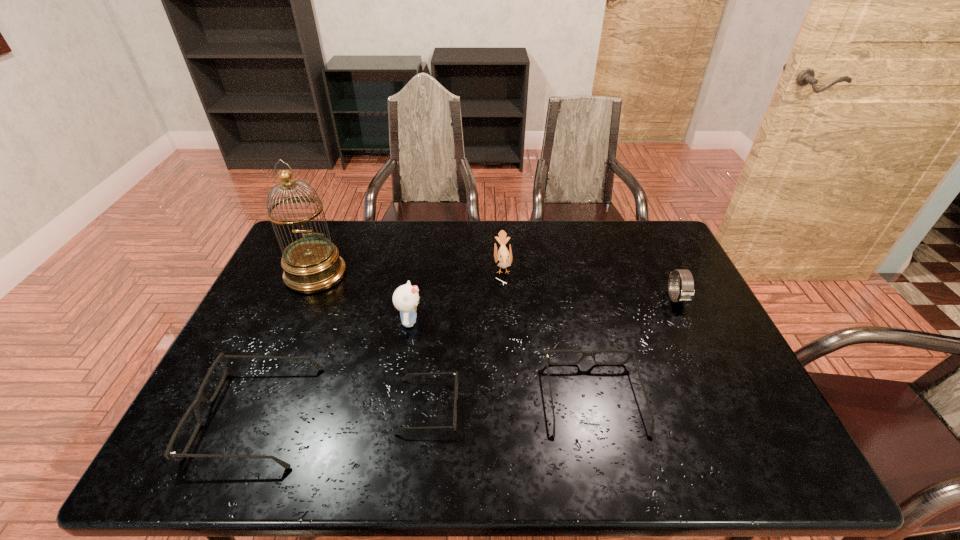
The image size is (960, 540). Find the location of `bird at the far edge`. bird at the far edge is located at coordinates (503, 258).

The height and width of the screenshot is (540, 960). Identify the location of birdcage at the far edge. (312, 264).

At what (x,y) coordinates should I click in order to perform the action: click on spectacles located at the left edge. Please return your answer as a coordinate pair (x, y). Looking at the image, I should click on (169, 454).

The image size is (960, 540). In order to click on birdcage positioned at the left edge in this screenshot , I will do `click(312, 264)`.

I want to click on object that is at the right edge, so click(686, 294).

You are a GUI agent. You are given a task and a screenshot of the screen. Output one action in this format:
    pyautogui.click(x=<x>, y=<y>)
    Task: Click on the object at the far left corner
    
    Given the screenshot: What is the action you would take?
    pyautogui.click(x=312, y=264)

Locate an element on the screen. This screenshot has width=960, height=540. object at the near left corner is located at coordinates 169,454.

Find the location of a particular element. Image resolution: width=960 pixels, height=540 pixels. free spot at the far edge of the desktop is located at coordinates (525, 259).

The height and width of the screenshot is (540, 960). In order to click on vacant space at the near edge in this screenshot , I will do `click(577, 409)`.

At what (x,y) coordinates should I click in order to perform the action: click on free space at the left edge. Please return your answer as a coordinate pair (x, y). Looking at the image, I should click on tap(297, 314).